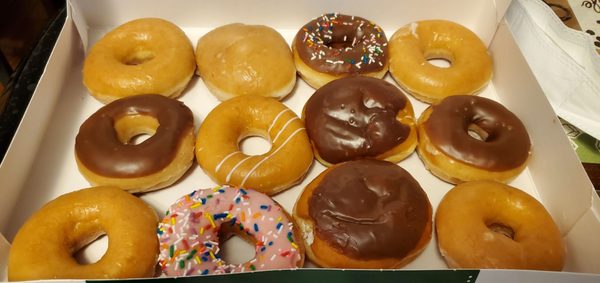
Find the location of `napkin`. napkin is located at coordinates (573, 63).